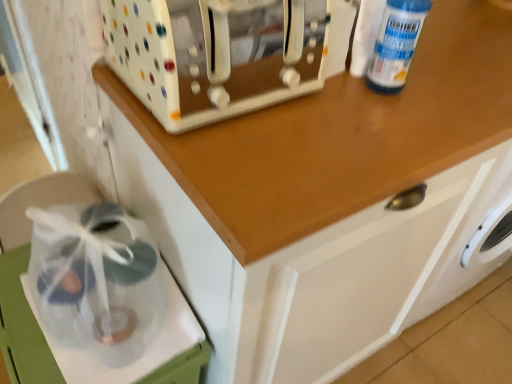
This screenshot has height=384, width=512. What are the coordinates of `vacant space in front of white glossy toaster at upper center` in the screenshot? It's located at (252, 164).